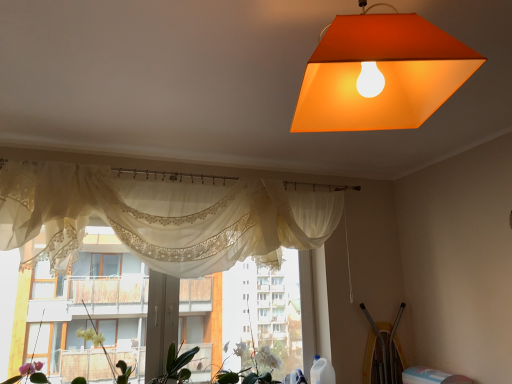
Question: Considering the relative sizes of sheer white curtain at center and green leafy plant at center, which appears as the 3th plant when viewed from the right, in the image provided, is sheer white curtain at center wider than green leafy plant at center, which appears as the 3th plant when viewed from the right,?

Choices:
 (A) no
 (B) yes

Answer: (A)

Question: From a real-world perspective, is sheer white curtain at center located beneath green leafy plant at center, the first plant when ordered from left to right?

Choices:
 (A) no
 (B) yes

Answer: (A)

Question: From the image's perspective, does sheer white curtain at center appear lower than green leafy plant at center, which appears as the 3th plant when viewed from the right?

Choices:
 (A) yes
 (B) no

Answer: (B)

Question: Can you confirm if sheer white curtain at center is thinner than green leafy plant at center, which appears as the 3th plant when viewed from the right?

Choices:
 (A) no
 (B) yes

Answer: (B)

Question: Is green leafy plant at center, which appears as the 3th plant when viewed from the right, a part of sheer white curtain at center?

Choices:
 (A) no
 (B) yes

Answer: (A)

Question: Is green matte plant at lower center, the 2th plant viewed from the right, taller or shorter than sheer white curtain at center?

Choices:
 (A) short
 (B) tall

Answer: (A)

Question: Relative to sheer white curtain at center, is green matte plant at lower center, the 2th plant viewed from the right, in front or behind?

Choices:
 (A) behind
 (B) front

Answer: (A)

Question: Which is correct: green matte plant at lower center, which ranks as the second plant in left-to-right order, is inside sheer white curtain at center, or outside of it?

Choices:
 (A) inside
 (B) outside

Answer: (B)

Question: From a real-world perspective, is green matte plant at lower center, which ranks as the second plant in left-to-right order, positioned above or below sheer white curtain at center?

Choices:
 (A) above
 (B) below

Answer: (B)

Question: From a real-world perspective, is orange matte lampshade at upper center physically located above or below green leafy plant at center, the first plant when ordered from left to right?

Choices:
 (A) below
 (B) above

Answer: (B)

Question: Relative to green leafy plant at center, which appears as the 3th plant when viewed from the right, is orange matte lampshade at upper center in front or behind?

Choices:
 (A) behind
 (B) front

Answer: (B)

Question: From the image's perspective, is orange matte lampshade at upper center positioned above or below green leafy plant at center, which appears as the 3th plant when viewed from the right?

Choices:
 (A) below
 (B) above

Answer: (B)

Question: In terms of width, does orange matte lampshade at upper center look wider or thinner when compared to green leafy plant at center, the first plant when ordered from left to right?

Choices:
 (A) thin
 (B) wide

Answer: (B)

Question: From the image's perspective, is green leafy plant at center, which appears as the 3th plant when viewed from the right, above or below sheer lace curtains at center?

Choices:
 (A) above
 (B) below

Answer: (B)

Question: Is green leafy plant at center, which appears as the 3th plant when viewed from the right, spatially inside sheer lace curtains at center, or outside of it?

Choices:
 (A) inside
 (B) outside

Answer: (A)